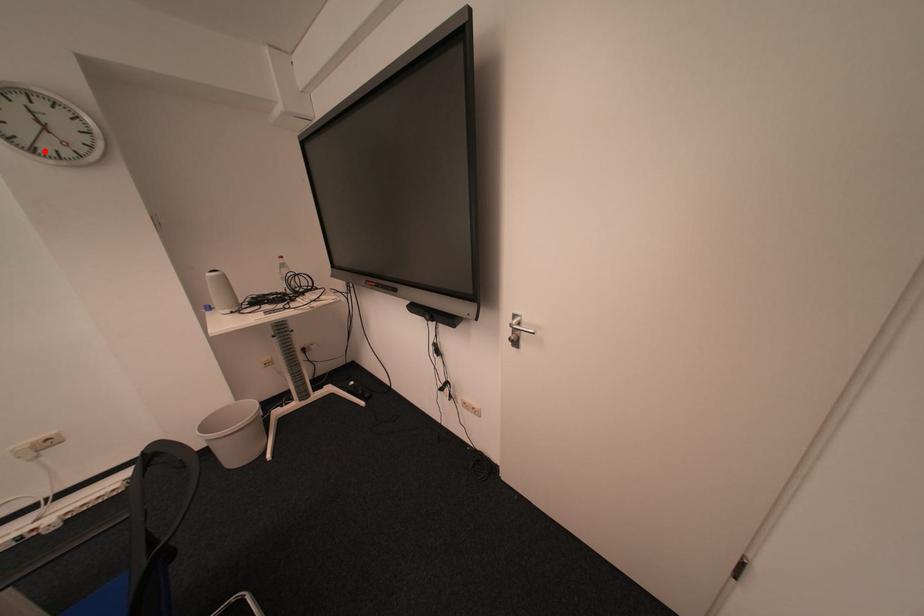
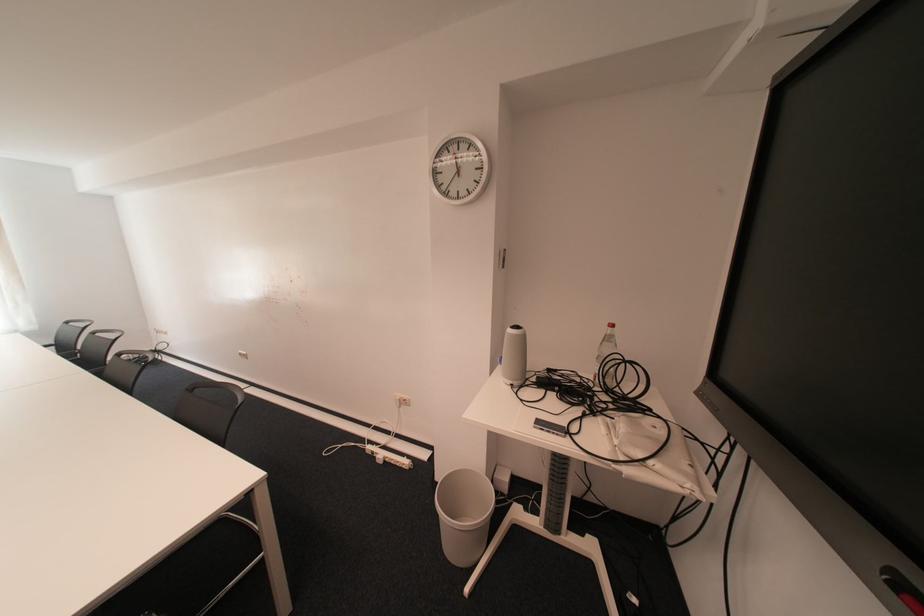
The point at the highlighted location is marked in the first image. Where is the corresponding point in the second image?

(457, 195)